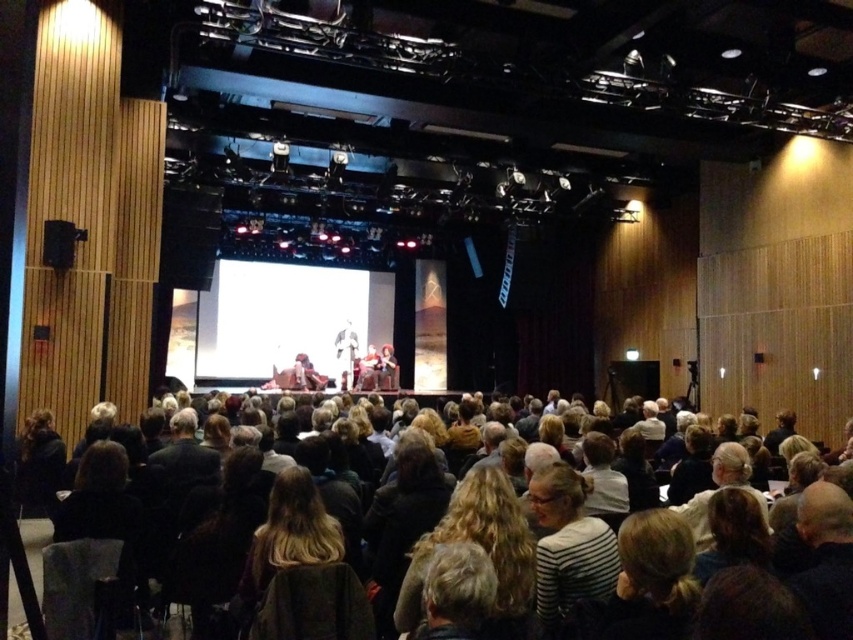
Is point (558, 593) positioned behind point (360, 406)?

No, (558, 593) is closer to viewer.

Which is behind, point (561, 540) or point (701, 545)?

The point (701, 545) is behind.

Find the location of a particular element. striped cotton shirt at lower center is located at coordinates (567, 545).